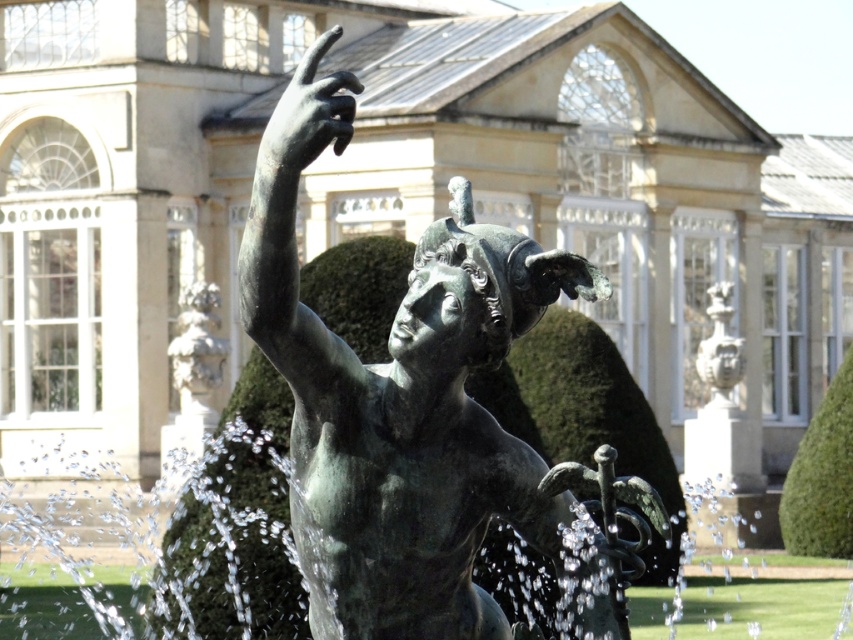
Who is shorter, bronze statue at center or smooth white stone cherub at left?

With less height is smooth white stone cherub at left.

Measure the distance from bronze statue at center to smooth white stone cherub at left.

bronze statue at center and smooth white stone cherub at left are 46.92 meters apart from each other.

Find the location of a particular element. The image size is (853, 640). bronze statue at center is located at coordinates (399, 397).

Where is `bronze statue at center`? bronze statue at center is located at coordinates (399, 397).

Which is above, bronze hand at upper center or polished bronze mask at upper right?

bronze hand at upper center is higher up.

Does bronze hand at upper center appear under polished bronze mask at upper right?

Incorrect, bronze hand at upper center is not positioned below polished bronze mask at upper right.

Is point (335, 29) positioned before point (715, 353)?

Yes.

Locate an element on the screen. The image size is (853, 640). bronze hand at upper center is located at coordinates (308, 115).

Does point (334, 561) come in front of point (265, 147)?

That is False.

Who is more forward, (399, 374) or (257, 168)?

Positioned in front is point (257, 168).

Find the location of a particular element. The width and height of the screenshot is (853, 640). bronze statue at center is located at coordinates 399,397.

You are a GUI agent. You are given a task and a screenshot of the screen. Output one action in this format:
    pyautogui.click(x=<x>, y=<y>)
    Task: Click on the bronze statue at center
    Image resolution: width=853 pixels, height=640 pixels.
    Given the screenshot: What is the action you would take?
    pyautogui.click(x=399, y=397)